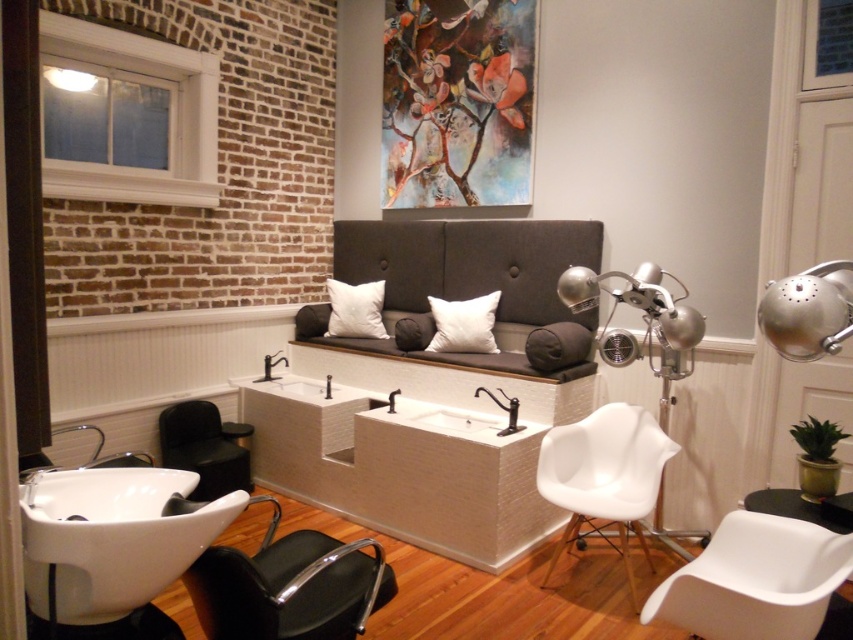
Can you confirm if dark gray fabric couch at center is wider than white plastic swivel chair at lower right?

Correct, the width of dark gray fabric couch at center exceeds that of white plastic swivel chair at lower right.

Which of these two, dark gray fabric couch at center or white plastic swivel chair at lower right, stands taller?

dark gray fabric couch at center

Is point (531, 268) less distant than point (746, 627)?

That is False.

The width and height of the screenshot is (853, 640). I want to click on dark gray fabric couch at center, so click(471, 289).

Is dark gray fabric couch at center positioned in front of white soft cushion at center?

Yes.

Can you confirm if dark gray fabric couch at center is shorter than white soft cushion at center?

Incorrect, dark gray fabric couch at center's height does not fall short of white soft cushion at center's.

Is point (334, 344) positioned after point (352, 296)?

No, it is not.

I want to click on dark gray fabric couch at center, so click(x=471, y=289).

Who is more distant from viewer, (x=791, y=620) or (x=827, y=307)?

The point (x=791, y=620) is behind.

Identify the location of white plastic swivel chair at lower right. (755, 580).